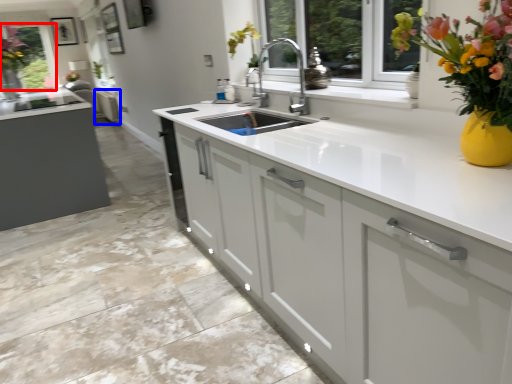
Question: Which object is closer to the camera taking this photo, window screen (highlighted by a red box) or cabinetry (highlighted by a blue box)?

Choices:
 (A) window screen
 (B) cabinetry

Answer: (A)